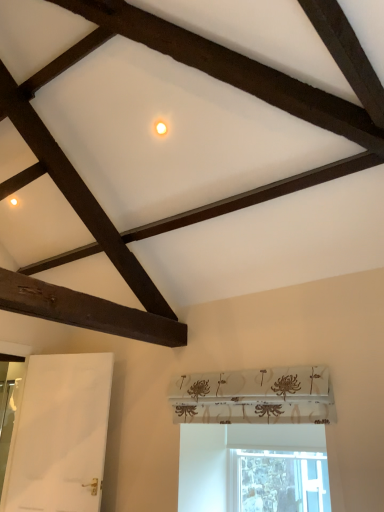
The image size is (384, 512). What do you see at coordinates (59, 434) in the screenshot? I see `white matte door at lower left` at bounding box center [59, 434].

Find the location of a particular element. Image resolution: width=384 pixels, height=512 pixels. white matte door at lower left is located at coordinates (59, 434).

The image size is (384, 512). Describe the element at coordinates (253, 468) in the screenshot. I see `transparent glass window at lower center` at that location.

Locate an element on the screen. The height and width of the screenshot is (512, 384). transparent glass window at lower center is located at coordinates (253, 468).

The width and height of the screenshot is (384, 512). I want to click on white matte door at lower left, so click(59, 434).

Considering the positions of objects transparent glass window at lower center and white matte door at lower left in the image provided, who is more to the right, transparent glass window at lower center or white matte door at lower left?

From the viewer's perspective, transparent glass window at lower center appears more on the right side.

Consider the image. Does transparent glass window at lower center come in front of white matte door at lower left?

Yes, it is in front of white matte door at lower left.

Is point (312, 499) positioned in front of point (66, 384)?

Yes, point (312, 499) is in front of point (66, 384).

From the image's perspective, is transparent glass window at lower center above or below white matte door at lower left?

From the image's perspective, transparent glass window at lower center appears below white matte door at lower left.

From a real-world perspective, is transparent glass window at lower center beneath white matte door at lower left?

Indeed, from a real-world perspective, transparent glass window at lower center is positioned beneath white matte door at lower left.

Which of these two, transparent glass window at lower center or white matte door at lower left, is thinner?

Thinner between the two is transparent glass window at lower center.

Can you confirm if transparent glass window at lower center is shorter than white matte door at lower left?

Correct, transparent glass window at lower center is not as tall as white matte door at lower left.

Does transparent glass window at lower center have a larger size compared to white matte door at lower left?

No.

Would you say white matte door at lower left is part of transparent glass window at lower center's contents?

That's incorrect, white matte door at lower left is not inside transparent glass window at lower center.

Is transparent glass window at lower center far from white matte door at lower left?

transparent glass window at lower center is far away from white matte door at lower left.

Is transparent glass window at lower center facing away from white matte door at lower left?

A: No, transparent glass window at lower center is not facing away from white matte door at lower left.

Identify the location of screen door that appears above the transparent glass window at lower center (from the image's perspective). This screenshot has width=384, height=512. (59, 434).

Is white matte door at lower left at the right side of transparent glass window at lower center?

No, white matte door at lower left is not to the right of transparent glass window at lower center.

Based on the photo, in the image, is white matte door at lower left positioned in front of or behind transparent glass window at lower center?

Clearly, white matte door at lower left is behind transparent glass window at lower center.

Considering the points (38, 451) and (271, 447), which point is in front, point (38, 451) or point (271, 447)?

Point (271, 447)

From the image's perspective, which is below, white matte door at lower left or transparent glass window at lower center?

transparent glass window at lower center appears lower in the image.

From a real-world perspective, is white matte door at lower left below transparent glass window at lower center?

No, from a real-world perspective, white matte door at lower left is not beneath transparent glass window at lower center.

Which object is thinner, white matte door at lower left or transparent glass window at lower center?

A: transparent glass window at lower center.

Looking at this image, which of these two, white matte door at lower left or transparent glass window at lower center, stands shorter?

transparent glass window at lower center is shorter.

Considering the sizes of objects white matte door at lower left and transparent glass window at lower center in the image provided, who is bigger, white matte door at lower left or transparent glass window at lower center?

Bigger between the two is white matte door at lower left.

Would you say white matte door at lower left is outside transparent glass window at lower center?

Absolutely, white matte door at lower left is external to transparent glass window at lower center.

Looking at this image, is white matte door at lower left next to transparent glass window at lower center?

white matte door at lower left and transparent glass window at lower center are clearly separated.

Does white matte door at lower left turn towards transparent glass window at lower center?

No, white matte door at lower left does not turn towards transparent glass window at lower center.

What's the angular difference between white matte door at lower left and transparent glass window at lower center's facing directions?

There is a 18.5-degree angle between the facing directions of white matte door at lower left and transparent glass window at lower center.

The height and width of the screenshot is (512, 384). I want to click on screen door behind the transparent glass window at lower center, so click(x=59, y=434).

Image resolution: width=384 pixels, height=512 pixels. In order to click on window in front of the white matte door at lower left in this screenshot , I will do `click(253, 468)`.

This screenshot has width=384, height=512. What are the coordinates of `screen door above the transparent glass window at lower center (from the image's perspective)` in the screenshot? It's located at (59, 434).